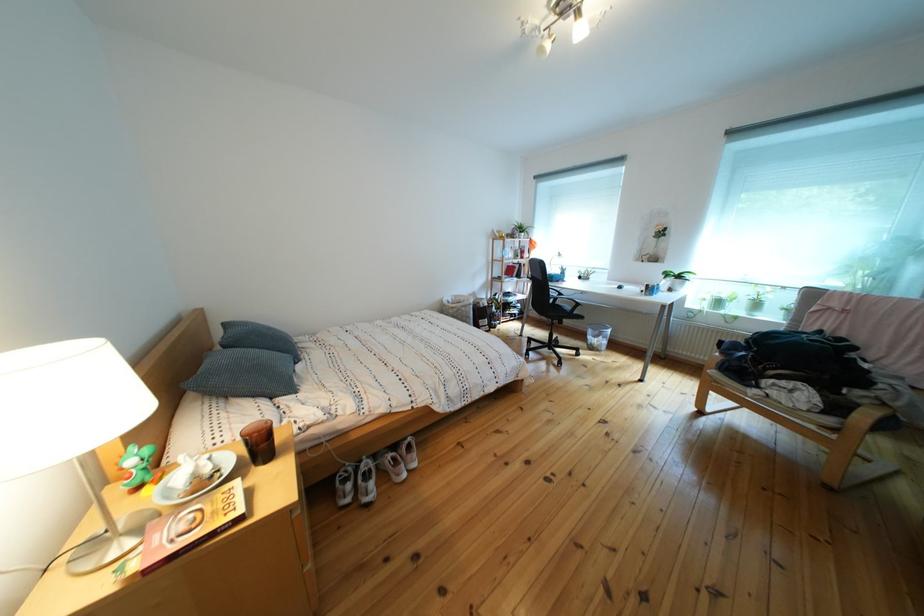
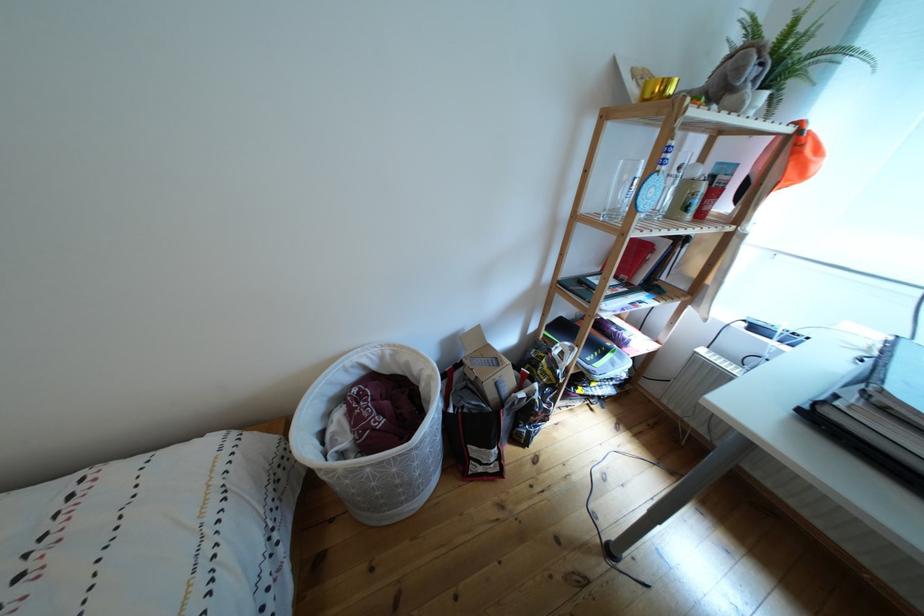
Question: Which direction would the cameraman need to move to produce the second image? Reply with the corresponding letter.

Choices:
 (A) Left
 (B) Right
 (C) Forward
 (D) Backward

Answer: (C)